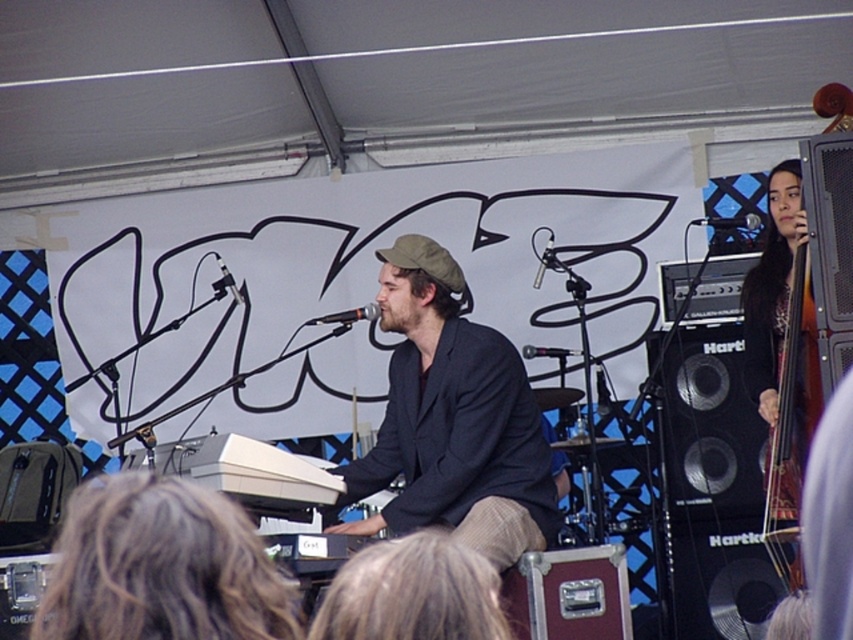
You are a photographer setting up for a live music shoot. You need to position a light source to the left of the dark gray fabric jacket at center and above the black matte microphone at upper center. Is this possible based on the scene description?

The dark gray fabric jacket at center is to the right of the black matte microphone at upper center, so placing a light to the left of the jacket would also be to the left of the microphone. However, the microphone is at upper center, so positioning the light above it while keeping it to the left of the jacket is possible as they are positioned horizontally relative to each other.

You are a photographer at the live music performance. You want to take a photo that includes both the keyboard player and the double bass player. The keyboard player is at point [387,417] and the double bass player is at point [233,282]. Based on their positions, which musician is closer to your camera?

Point [387,417] is closer to the camera than point [233,282]. Therefore, the keyboard player at point [387,417] is closer to your camera than the double bass player at point [233,282].